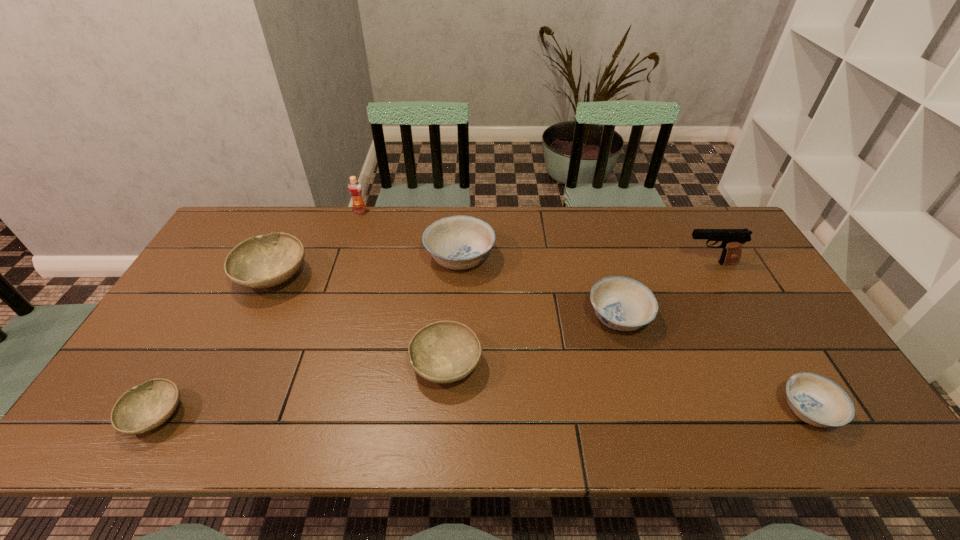
This screenshot has height=540, width=960. In order to click on free space that satisfies the following two spatial constraints: 1. on the front side of the smallest blue bowl; 2. on the right side of the farthest gray bowl in this screenshot , I will do `click(208, 410)`.